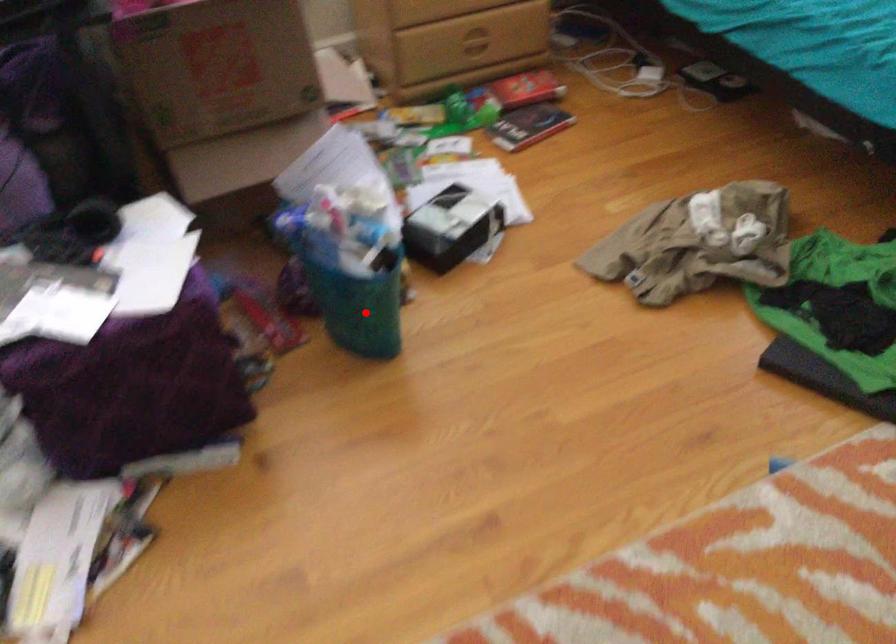
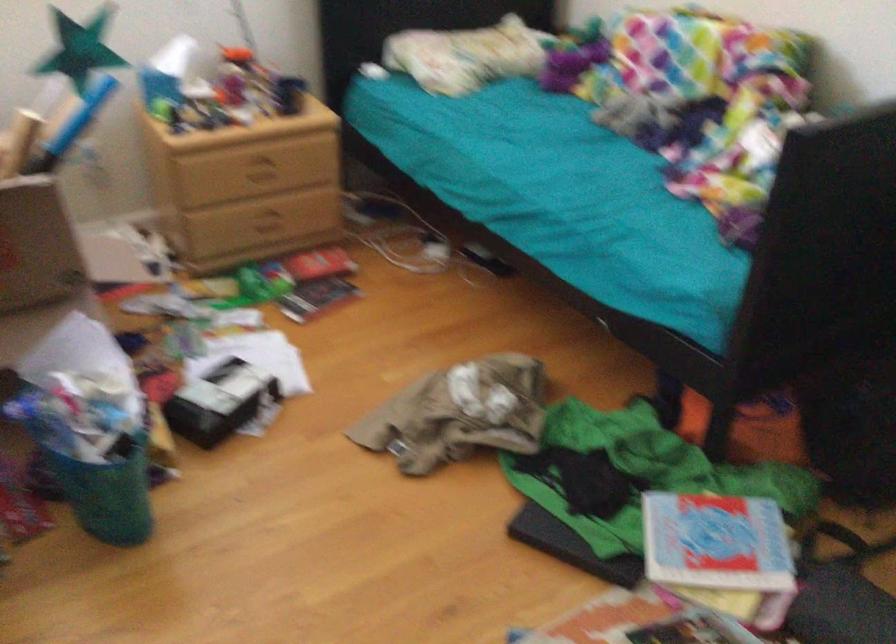
In the second image, find the point that corresponds to the highlighted location in the first image.

(107, 494)